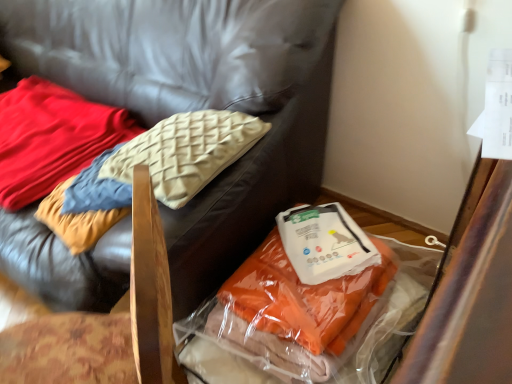
Question: In the image, is orange fabric at lower right positioned in front of or behind soft cream pillow at upper left?

Choices:
 (A) front
 (B) behind

Answer: (A)

Question: Is orange fabric at lower right taller or shorter than soft cream pillow at upper left?

Choices:
 (A) tall
 (B) short

Answer: (A)

Question: Considering the real-world distances, which object is closest to the soft cream pillow at upper left?

Choices:
 (A) velvet cushion at upper left, which is the 1th furniture from right to left
 (B) translucent plastic bag at lower right, which is the 1th furniture from left to right
 (C) white plastic kit at lower right
 (D) orange fabric at lower right

Answer: (B)

Question: Which object is the closest to the white plastic kit at lower right?

Choices:
 (A) velvet cushion at upper left, the 2th furniture viewed from the left
 (B) orange fabric at lower right
 (C) soft cream pillow at upper left
 (D) translucent plastic bag at lower right, the 2th furniture when ordered from right to left

Answer: (B)